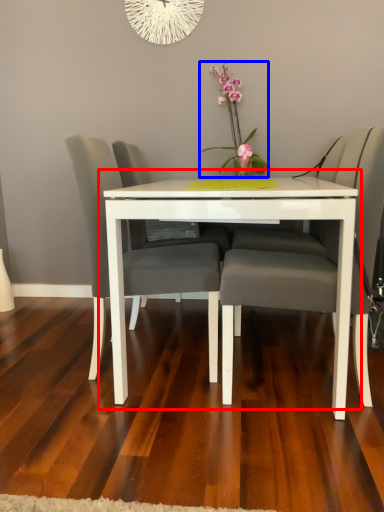
Question: Which object is further to the camera taking this photo, table (highlighted by a red box) or floral arrangement (highlighted by a blue box)?

Choices:
 (A) table
 (B) floral arrangement

Answer: (B)